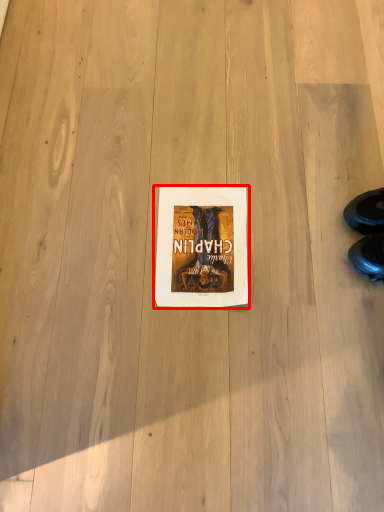
Question: Considering the relative positions of paperback book (annotated by the red box) and leather shoe in the image provided, where is paperback book (annotated by the red box) located with respect to the staircase?

Choices:
 (A) right
 (B) left

Answer: (B)